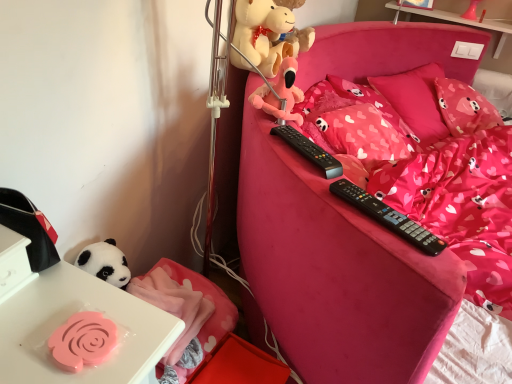
You are a GUI agent. You are given a task and a screenshot of the screen. Output one action in this format:
    pyautogui.click(x=<x>, y=<y>)
    Task: Click on the spots to the right of pink fabric blanket at lower left
    The image size is (512, 384).
    Given the screenshot: What is the action you would take?
    pyautogui.click(x=227, y=360)